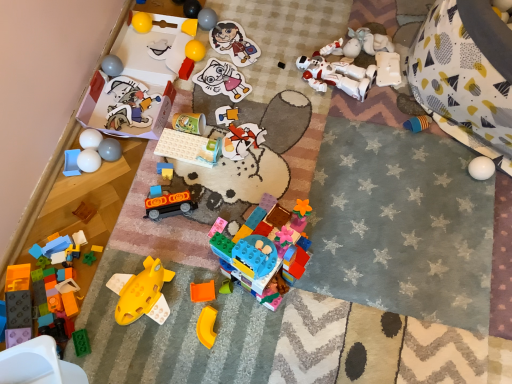
Question: Which direction should I rotate to look at matte plastic sticker at upper center, marked as the fourth toy in a right-to-left arrangement?

Choices:
 (A) left
 (B) right

Answer: (A)

Question: Is black plastic train at center, which is counted as the tenth toy, starting from the left, outside glossy plastic ball at upper left, the sixth toy from the left?

Choices:
 (A) no
 (B) yes

Answer: (B)

Question: Does black plastic train at center, which is counted as the tenth toy, starting from the left, have a smaller size compared to glossy plastic ball at upper left, the sixth toy from the left?

Choices:
 (A) yes
 (B) no

Answer: (B)

Question: Is black plastic train at center, which is counted as the tenth toy, starting from the left, positioned in front of glossy plastic ball at upper left, which appears as the eighteenth toy when viewed from the right?

Choices:
 (A) yes
 (B) no

Answer: (A)

Question: Considering the relative positions of black plastic train at center, which is counted as the tenth toy, starting from the left, and glossy plastic ball at upper left, which appears as the eighteenth toy when viewed from the right, in the image provided, is black plastic train at center, which is counted as the tenth toy, starting from the left, to the right of glossy plastic ball at upper left, which appears as the eighteenth toy when viewed from the right, from the viewer's perspective?

Choices:
 (A) yes
 (B) no

Answer: (A)

Question: Is black plastic train at center, the 14th toy from the right, to the left of glossy plastic ball at upper left, the sixth toy from the left, from the viewer's perspective?

Choices:
 (A) no
 (B) yes

Answer: (A)

Question: Does black plastic train at center, which is counted as the tenth toy, starting from the left, have a lesser width compared to glossy plastic ball at upper left, the sixth toy from the left?

Choices:
 (A) no
 (B) yes

Answer: (A)

Question: Could you tell me if yellow matte plastic piece at center, the seventeenth toy viewed from the left, is facing white plastic robot at upper right, which appears as the second toy when viewed from the right?

Choices:
 (A) no
 (B) yes

Answer: (A)

Question: Would you say yellow matte plastic piece at center, the seventh toy when ordered from right to left, contains white plastic robot at upper right, which appears as the second toy when viewed from the right?

Choices:
 (A) yes
 (B) no

Answer: (B)

Question: Is yellow matte plastic piece at center, the seventeenth toy viewed from the left, smaller than white plastic robot at upper right, which appears as the second toy when viewed from the right?

Choices:
 (A) yes
 (B) no

Answer: (A)

Question: Is yellow matte plastic piece at center, the seventeenth toy viewed from the left, not inside white plastic robot at upper right, which appears as the second toy when viewed from the right?

Choices:
 (A) yes
 (B) no

Answer: (A)

Question: From the image's perspective, is yellow matte plastic piece at center, the seventh toy when ordered from right to left, above white plastic robot at upper right, which appears as the second toy when viewed from the right?

Choices:
 (A) yes
 (B) no

Answer: (B)

Question: From a real-world perspective, is yellow matte plastic piece at center, the seventeenth toy viewed from the left, under white plastic robot at upper right, which appears as the second toy when viewed from the right?

Choices:
 (A) no
 (B) yes

Answer: (A)

Question: Is yellow matte block at center, which appears as the 13th toy when viewed from the right, taller than white matte robot at center, which is counted as the 21th toy, starting from the left?

Choices:
 (A) no
 (B) yes

Answer: (A)